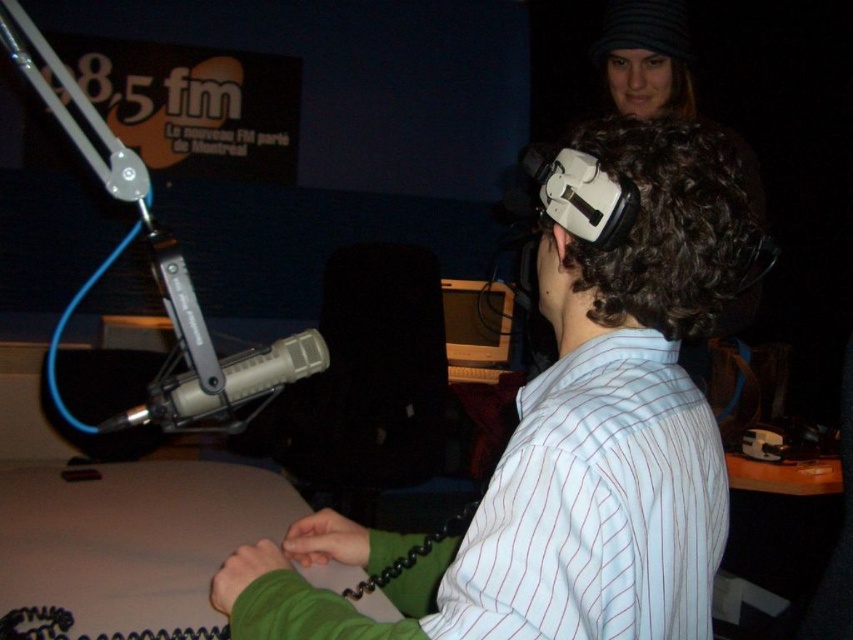
Is matte gray microphone at left above wooden desktop computer at center?

Incorrect, matte gray microphone at left is not positioned above wooden desktop computer at center.

Which is more to the right, matte gray microphone at left or wooden desktop computer at center?

wooden desktop computer at center is more to the right.

Identify the location of matte gray microphone at left. This screenshot has height=640, width=853. (223, 385).

Does white matte vr headset at center lie behind wooden desktop computer at center?

No, white matte vr headset at center is closer to the viewer.

The height and width of the screenshot is (640, 853). What do you see at coordinates (569, 442) in the screenshot?
I see `white matte vr headset at center` at bounding box center [569, 442].

What are the coordinates of `white matte vr headset at center` in the screenshot? It's located at (569, 442).

Does point (645, 358) come in front of point (242, 349)?

Yes, point (645, 358) is closer to viewer.

Is white matte vr headset at center below matte gray microphone at left?

Correct, white matte vr headset at center is located below matte gray microphone at left.

What do you see at coordinates (569, 442) in the screenshot?
I see `white matte vr headset at center` at bounding box center [569, 442].

What are the coordinates of `white matte vr headset at center` in the screenshot? It's located at (569, 442).